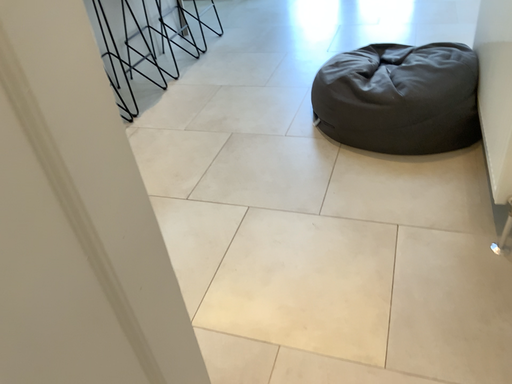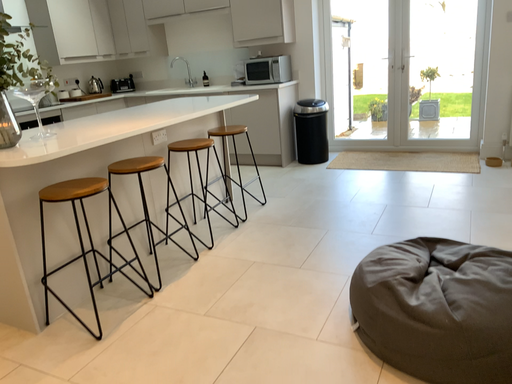
Question: How did the camera likely rotate when shooting the video?

Choices:
 (A) rotated downward
 (B) rotated upward

Answer: (B)